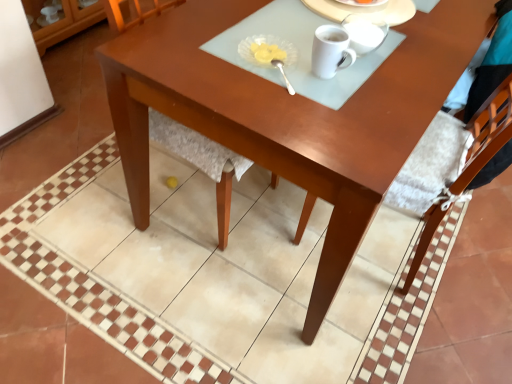
This screenshot has height=384, width=512. Describe the element at coordinates (289, 114) in the screenshot. I see `glossy wood desk at center` at that location.

You are a GUI agent. You are given a task and a screenshot of the screen. Output one action in this format:
    pyautogui.click(x=<x>, y=<y>)
    Task: Click on the glossy wood desk at center
    The height and width of the screenshot is (384, 512).
    Given the screenshot: What is the action you would take?
    pyautogui.click(x=289, y=114)

This screenshot has width=512, height=384. What do you see at coordinates (169, 85) in the screenshot?
I see `wooden chair at center` at bounding box center [169, 85].

The height and width of the screenshot is (384, 512). What do you see at coordinates (364, 33) in the screenshot?
I see `white glossy mug at upper center, arranged as the second tableware when viewed from the top` at bounding box center [364, 33].

Measure the distance between translucent glass dish at upper center, positioned as the third tableware in top-to-bottom order, and camera.

They are 3.55 feet apart.

Where is `glossy wood desk at center`? Image resolution: width=512 pixels, height=384 pixels. glossy wood desk at center is located at coordinates (289, 114).

Is white glossy mug at upper center, which is the 4th tableware in bottom-to-top order, placed right next to wooden chair at center?

They are not placed beside each other.

Is white glossy mug at upper center, which is the 4th tableware in bottom-to-top order, oriented away from wooden chair at center?

No, white glossy mug at upper center, which is the 4th tableware in bottom-to-top order,'s orientation is not away from wooden chair at center.

In the image, is glossy wood desk at center on the left side or the right side of white glossy mug at upper center?

From the image, it's evident that glossy wood desk at center is to the right of white glossy mug at upper center.

From a real-world perspective, relative to white glossy mug at upper center, is glossy wood desk at center vertically above or below?

From a real-world perspective, glossy wood desk at center is physically below white glossy mug at upper center.

Locate an element on the screen. The width and height of the screenshot is (512, 384). coffee cup above the glossy wood desk at center (from a real-world perspective) is located at coordinates (330, 51).

From the image's perspective, which is below, glossy wood desk at center or white glossy mug at upper center?

white glossy mug at upper center.

Is translucent glass dish at upper center, positioned as the third tableware in top-to-bottom order, facing away from wooden chair at center?

Yes, wooden chair at center is at the back of translucent glass dish at upper center, positioned as the third tableware in top-to-bottom order.

Is translucent glass dish at upper center, positioned as the third tableware in top-to-bottom order, to the right of wooden chair at center from the viewer's perspective?

Indeed, translucent glass dish at upper center, positioned as the third tableware in top-to-bottom order, is positioned on the right side of wooden chair at center.

Locate an element on the screen. This screenshot has width=512, height=384. the 2nd tableware behind the wooden chair at center is located at coordinates (267, 50).

From a real-world perspective, is translucent glass dish at upper center, positioned as the third tableware in top-to-bottom order, physically located above or below wooden chair at center?

In terms of real-world spatial position, translucent glass dish at upper center, positioned as the third tableware in top-to-bottom order, is above wooden chair at center.

Considering the relative sizes of wooden chair at center and glossy wood desk at center in the image provided, is wooden chair at center smaller than glossy wood desk at center?

Correct, wooden chair at center occupies less space than glossy wood desk at center.

Is glossy wood desk at center a part of wooden chair at center?

That's incorrect, glossy wood desk at center is not inside wooden chair at center.

Based on the photo, between wooden chair at center and glossy wood desk at center, which one has smaller width?

Thinner between the two is wooden chair at center.

Is wooden chair at center positioned with its back to glossy wood desk at center?

Correct, wooden chair at center is looking away from glossy wood desk at center.

Considering the positions of points (372, 40) and (275, 37), is point (372, 40) closer to camera compared to point (275, 37)?

No, (372, 40) is behind (275, 37).

From the image's perspective, does white glossy mug at upper center, positioned as the third tableware in bottom-to-top order, appear lower than translucent glass dish at upper center, the 2th tableware ordered from the bottom?

No, from the image's perspective, white glossy mug at upper center, positioned as the third tableware in bottom-to-top order, is not beneath translucent glass dish at upper center, the 2th tableware ordered from the bottom.

Would you say white glossy mug at upper center, arranged as the second tableware when viewed from the top, is a long distance from translucent glass dish at upper center, the 2th tableware ordered from the bottom?

No, white glossy mug at upper center, arranged as the second tableware when viewed from the top, is in close proximity to translucent glass dish at upper center, the 2th tableware ordered from the bottom.

How different are the orientations of white glossy mug at upper center, arranged as the second tableware when viewed from the top, and translucent glass dish at upper center, positioned as the third tableware in top-to-bottom order, in degrees?

The angle between the facing direction of white glossy mug at upper center, arranged as the second tableware when viewed from the top, and the facing direction of translucent glass dish at upper center, positioned as the third tableware in top-to-bottom order, is 0.000115 degrees.

From a real-world perspective, which is physically above, white glossy mug at upper center, arranged as the second tableware when viewed from the top, or wooden chair at center?

In real-world perspective, white glossy mug at upper center, arranged as the second tableware when viewed from the top, is above.

Locate an element on the screen. The height and width of the screenshot is (384, 512). chair that appears in front of the white glossy mug at upper center, arranged as the second tableware when viewed from the top is located at coordinates (169, 85).

Considering the positions of points (383, 23) and (219, 184), is point (383, 23) farther from camera compared to point (219, 184)?

No.

From the image's perspective, is white glossy mug at upper center, positioned as the third tableware in bottom-to-top order, above or below wooden chair at center?

white glossy mug at upper center, positioned as the third tableware in bottom-to-top order, is above wooden chair at center.

Looking at the image, does translucent glass dish at upper center, the 2th tableware ordered from the bottom, seem bigger or smaller compared to white glossy mug at upper center, which is the 4th tableware in bottom-to-top order?

translucent glass dish at upper center, the 2th tableware ordered from the bottom, is smaller than white glossy mug at upper center, which is the 4th tableware in bottom-to-top order.

Is translucent glass dish at upper center, the 2th tableware ordered from the bottom, closer to the viewer compared to white glossy mug at upper center, which appears as the first tableware when viewed from the top?

That is True.

Who is shorter, translucent glass dish at upper center, the 2th tableware ordered from the bottom, or white glossy mug at upper center, which is the 4th tableware in bottom-to-top order?

Standing shorter between the two is translucent glass dish at upper center, the 2th tableware ordered from the bottom.

From a real-world perspective, count 3rd tablewares upward from the wooden chair at center and point to it. Please provide its 2D coordinates.

[(362, 3)]

Find the location of a particular element. coffee cup behind the glossy wood desk at center is located at coordinates (330, 51).

Looking at the image, which one is located closer to translucent glass dish at upper center, the 2th tableware ordered from the bottom, white glossy mug at upper center, which appears as the first tableware when viewed from the top, or silver metallic spoon at center, the first tableware when ordered from bottom to top?

silver metallic spoon at center, the first tableware when ordered from bottom to top, is positioned closer to the anchor translucent glass dish at upper center, the 2th tableware ordered from the bottom.

Based on their spatial positions, is white glossy mug at upper center, which is the 4th tableware in bottom-to-top order, or white glossy mug at upper center further from silver metallic spoon at center, which appears as the fourth tableware when viewed from the top?

Among the two, white glossy mug at upper center, which is the 4th tableware in bottom-to-top order, is located further to silver metallic spoon at center, which appears as the fourth tableware when viewed from the top.

Looking at the image, which one is located closer to translucent glass dish at upper center, positioned as the third tableware in top-to-bottom order, white glossy mug at upper center, which is the 4th tableware in bottom-to-top order, or glossy wood desk at center?

glossy wood desk at center is positioned closer to the anchor translucent glass dish at upper center, positioned as the third tableware in top-to-bottom order.

When comparing their distances from silver metallic spoon at center, the first tableware when ordered from bottom to top, does white glossy mug at upper center, which appears as the first tableware when viewed from the top, or translucent glass dish at upper center, positioned as the third tableware in top-to-bottom order, seem further?

The object further to silver metallic spoon at center, the first tableware when ordered from bottom to top, is white glossy mug at upper center, which appears as the first tableware when viewed from the top.

Which object lies nearer to the anchor point wooden chair at center, glossy wood desk at center or white glossy mug at upper center?

Among the two, glossy wood desk at center is located nearer to wooden chair at center.

When comparing their distances from white glossy mug at upper center, which is the 4th tableware in bottom-to-top order, does glossy wood desk at center or wooden chair at center seem further?

wooden chair at center lies further to white glossy mug at upper center, which is the 4th tableware in bottom-to-top order, than the other object.

Looking at the image, which one is located closer to white glossy mug at upper center, arranged as the second tableware when viewed from the top, white glossy mug at upper center or silver metallic spoon at center, the first tableware when ordered from bottom to top?

Among the two, white glossy mug at upper center is located nearer to white glossy mug at upper center, arranged as the second tableware when viewed from the top.

Estimate the real-world distances between objects in this image. Which object is further from translucent glass dish at upper center, positioned as the third tableware in top-to-bottom order, white glossy mug at upper center, which appears as the first tableware when viewed from the top, or white glossy mug at upper center?

The object further to translucent glass dish at upper center, positioned as the third tableware in top-to-bottom order, is white glossy mug at upper center, which appears as the first tableware when viewed from the top.

Where is `coffee cup between white glossy mug at upper center, which is the 4th tableware in bottom-to-top order, and silver metallic spoon at center, which appears as the fourth tableware when viewed from the top, vertically`? The width and height of the screenshot is (512, 384). coffee cup between white glossy mug at upper center, which is the 4th tableware in bottom-to-top order, and silver metallic spoon at center, which appears as the fourth tableware when viewed from the top, vertically is located at coordinates (330, 51).

This screenshot has width=512, height=384. What are the coordinates of `coffee cup between wooden chair at center and white glossy mug at upper center, which appears as the first tableware when viewed from the top, in the horizontal direction` in the screenshot? It's located at (330, 51).

This screenshot has width=512, height=384. I want to click on coffee cup between wooden chair at center and glossy wood desk at center, so click(x=330, y=51).

I want to click on coffee cup located between translucent glass dish at upper center, the 2th tableware ordered from the bottom, and white glossy mug at upper center, arranged as the second tableware when viewed from the top, in the left-right direction, so click(330, 51).